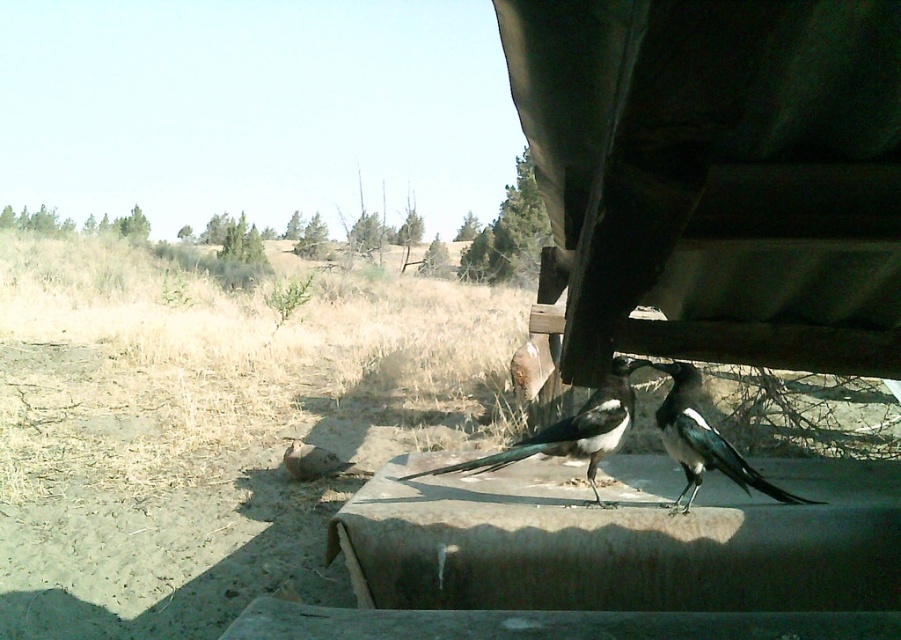
Consider the image. You are a birdwatcher trying to capture both magpies in a single photo with a camera that has a 12 inch wide field of view. Can you fit both the black glossy magpie at center and the black glossy magpie at lower right into your camera frame?

The black glossy magpie at center and black glossy magpie at lower right are 11.26 inches apart from each other. Since the distance between them is less than the 12 inch field of view, both magpies can fit into the camera frame.